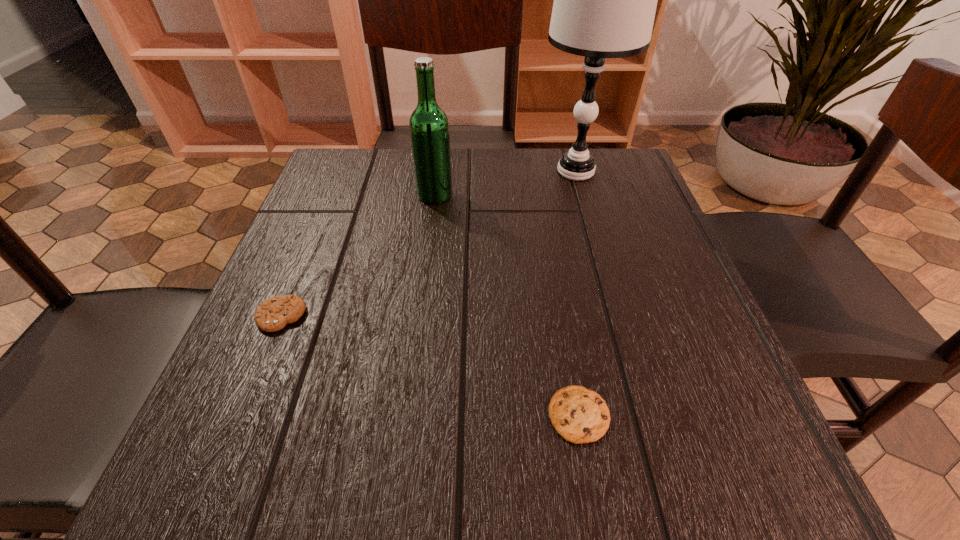
Where is `vacant area that lies between the third farthest object and the nearest object`? Image resolution: width=960 pixels, height=540 pixels. vacant area that lies between the third farthest object and the nearest object is located at coordinates (x=430, y=366).

Where is `vacant area that lies between the tallest object and the third shortest object`? vacant area that lies between the tallest object and the third shortest object is located at coordinates (505, 183).

Where is `empty location between the leftmost object and the second object from left to right`? This screenshot has width=960, height=540. empty location between the leftmost object and the second object from left to right is located at coordinates (358, 255).

This screenshot has width=960, height=540. I want to click on empty location between the tallest object and the right cookie, so click(x=577, y=293).

Locate which object ranks third in proximity to the beer bottle. Please provide its 2D coordinates. Your answer should be formatted as a tuple, i.e. [(x, y)], where the tuple contains the x and y coordinates of a point satisfying the conditions above.

[(578, 414)]

Where is `object that can be found as the third closest to the third farthest object`? The height and width of the screenshot is (540, 960). object that can be found as the third closest to the third farthest object is located at coordinates (605, 0).

The height and width of the screenshot is (540, 960). I want to click on free space in the image that satisfies the following two spatial constraints: 1. on the back side of the beer bottle; 2. on the left side of the table lamp, so click(438, 171).